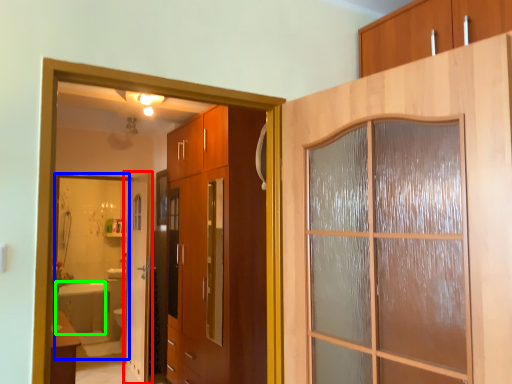
Question: Which object is the farthest from door (highlighted by a red box)? Choose among these: mirror (highlighted by a blue box) or bath (highlighted by a green box).

Choices:
 (A) mirror
 (B) bath

Answer: (B)